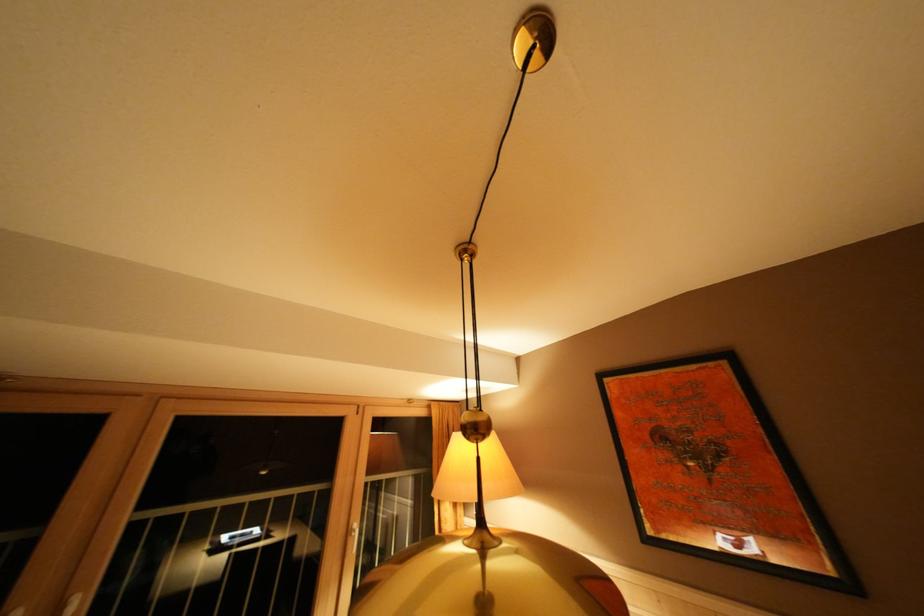
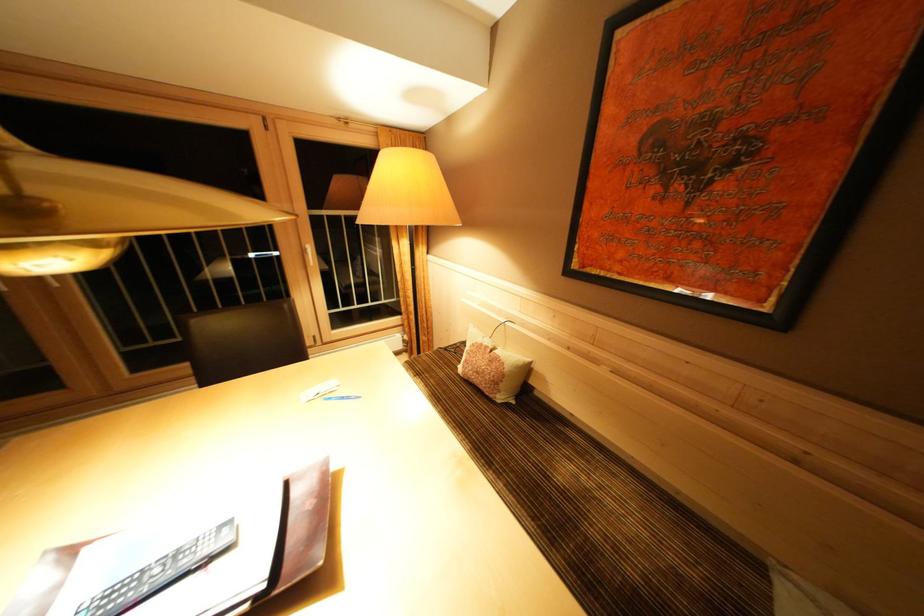
The point at (x=355, y=537) is marked in the first image. Where is the corresponding point in the second image?

(310, 256)